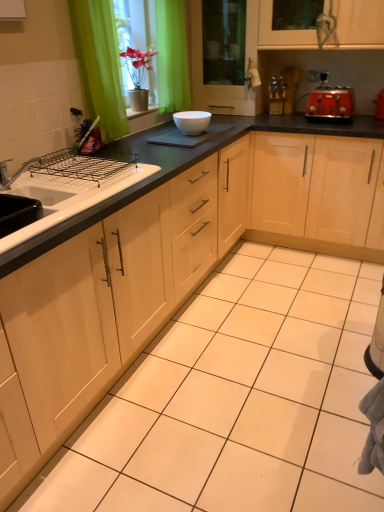
Describe the element at coordinates (315, 193) in the screenshot. I see `light wood cabinet at center, which ranks as the 1th cabinetry in right-to-left order` at that location.

Describe the element at coordinates (68, 187) in the screenshot. I see `white glossy sink at left` at that location.

The height and width of the screenshot is (512, 384). What are the coordinates of `red matte toaster at upper right` in the screenshot? It's located at (330, 102).

This screenshot has width=384, height=512. Describe the element at coordinates (100, 64) in the screenshot. I see `green fabric curtain at upper left` at that location.

From the picture: Measure the distance between point (114, 83) and camera.

The distance of point (114, 83) from camera is 2.24 meters.

This screenshot has width=384, height=512. What do you see at coordinates (192, 121) in the screenshot?
I see `white glossy bowl at center` at bounding box center [192, 121].

Locate an element on the screen. Image resolution: width=384 pixels, height=512 pixels. transparent glass screen door at upper center is located at coordinates (223, 55).

This screenshot has height=512, width=384. In order to click on light wood cabinet at center, which ranks as the 1th cabinetry in right-to-left order in this screenshot , I will do `click(315, 193)`.

Which object is thinner, red matte toaster at upper right or green fabric curtain at upper left?

green fabric curtain at upper left is thinner.

From a real-world perspective, which is physically below, red matte toaster at upper right or green fabric curtain at upper left?

red matte toaster at upper right is physically lower.

In the scene shown: Considering the relative sizes of red matte toaster at upper right and green fabric curtain at upper left in the image provided, is red matte toaster at upper right bigger than green fabric curtain at upper left?

Actually, red matte toaster at upper right might be smaller than green fabric curtain at upper left.

Considering the relative sizes of red matte toaster at upper right and green fabric curtain at upper left in the image provided, is red matte toaster at upper right shorter than green fabric curtain at upper left?

Yes.

In the image, is light wood cabinet at center, which appears as the second cabinetry when viewed from the left, positioned in front of or behind red matte toaster at upper right?

In the image, light wood cabinet at center, which appears as the second cabinetry when viewed from the left, appears in front of red matte toaster at upper right.

From a real-world perspective, does light wood cabinet at center, which ranks as the 1th cabinetry in right-to-left order, sit lower than red matte toaster at upper right?

Yes, from a real-world perspective, light wood cabinet at center, which ranks as the 1th cabinetry in right-to-left order, is below red matte toaster at upper right.

Where is `appliance above the light wood cabinet at center, which ranks as the 1th cabinetry in right-to-left order (from a real-world perspective)`? This screenshot has width=384, height=512. appliance above the light wood cabinet at center, which ranks as the 1th cabinetry in right-to-left order (from a real-world perspective) is located at coordinates (330, 102).

Is transparent glass screen door at upper center surrounded by matte wood cabinet at center, which appears as the 2th cabinetry when viewed from the right?

Actually, transparent glass screen door at upper center is outside matte wood cabinet at center, which appears as the 2th cabinetry when viewed from the right.

In the image, is matte wood cabinet at center, the 1th cabinetry viewed from the left, positioned in front of or behind transparent glass screen door at upper center?

matte wood cabinet at center, the 1th cabinetry viewed from the left, is in front of transparent glass screen door at upper center.

Is matte wood cabinet at center, which appears as the 2th cabinetry when viewed from the right, to the left of transparent glass screen door at upper center from the viewer's perspective?

Correct, you'll find matte wood cabinet at center, which appears as the 2th cabinetry when viewed from the right, to the left of transparent glass screen door at upper center.

Is matte wood cabinet at center, which appears as the 2th cabinetry when viewed from the right, wider than transparent glass screen door at upper center?

Indeed, matte wood cabinet at center, which appears as the 2th cabinetry when viewed from the right, has a greater width compared to transparent glass screen door at upper center.

You are a GUI agent. You are given a task and a screenshot of the screen. Output one action in this format:
    pyautogui.click(x=<x>, y=<y>)
    Task: Click on the bowl below the transparent glass screen door at upper center (from the image's perspective)
    The height and width of the screenshot is (512, 384).
    Given the screenshot: What is the action you would take?
    pyautogui.click(x=192, y=121)

In terms of size, does transparent glass screen door at upper center appear bigger or smaller than white glossy bowl at center?

transparent glass screen door at upper center is bigger than white glossy bowl at center.

Are transparent glass screen door at upper center and white glossy bowl at center making contact?

No, transparent glass screen door at upper center is not beside white glossy bowl at center.

Is red matte toaster at upper right oriented towards matte wood cabinet at center, which appears as the 2th cabinetry when viewed from the right?

Yes, red matte toaster at upper right is turned towards matte wood cabinet at center, which appears as the 2th cabinetry when viewed from the right.

Is red matte toaster at upper right completely or partially outside of matte wood cabinet at center, the 1th cabinetry viewed from the left?

Indeed, red matte toaster at upper right is completely outside matte wood cabinet at center, the 1th cabinetry viewed from the left.

In the image, is red matte toaster at upper right positioned in front of or behind matte wood cabinet at center, which appears as the 2th cabinetry when viewed from the right?

Visually, red matte toaster at upper right is located behind matte wood cabinet at center, which appears as the 2th cabinetry when viewed from the right.

Visually, is red matte toaster at upper right positioned to the left or to the right of matte wood cabinet at center, which appears as the 2th cabinetry when viewed from the right?

red matte toaster at upper right is positioned on matte wood cabinet at center, which appears as the 2th cabinetry when viewed from the right,'s right side.

Is white glossy sink at left shorter than red matte toaster at upper right?

Yes, white glossy sink at left is shorter than red matte toaster at upper right.

How distant is white glossy sink at left from red matte toaster at upper right?

The distance of white glossy sink at left from red matte toaster at upper right is 1.63 meters.

Looking at this image, from the image's perspective, who appears lower, white glossy sink at left or red matte toaster at upper right?

white glossy sink at left is shown below in the image.

Identify the location of sink that is on the left side of red matte toaster at upper right. Image resolution: width=384 pixels, height=512 pixels. (68, 187).

Are matte wood cabinet at center, the 1th cabinetry viewed from the left, and red matte toaster at upper right making contact?

No, matte wood cabinet at center, the 1th cabinetry viewed from the left, is not next to red matte toaster at upper right.

Would you say red matte toaster at upper right is part of matte wood cabinet at center, which appears as the 2th cabinetry when viewed from the right,'s contents?

Actually, red matte toaster at upper right is outside matte wood cabinet at center, which appears as the 2th cabinetry when viewed from the right.

Considering the relative sizes of matte wood cabinet at center, which appears as the 2th cabinetry when viewed from the right, and red matte toaster at upper right in the image provided, is matte wood cabinet at center, which appears as the 2th cabinetry when viewed from the right, smaller than red matte toaster at upper right?

Incorrect, matte wood cabinet at center, which appears as the 2th cabinetry when viewed from the right, is not smaller in size than red matte toaster at upper right.

Is matte wood cabinet at center, the 1th cabinetry viewed from the left, in front of or behind red matte toaster at upper right in the image?

Visually, matte wood cabinet at center, the 1th cabinetry viewed from the left, is located in front of red matte toaster at upper right.

Locate an element on the screen. appliance lying on the right of green fabric curtain at upper left is located at coordinates (330, 102).

In the image, there is a light wood cabinet at center, which ranks as the 1th cabinetry in right-to-left order. Where is `appliance above it (from the image's perspective)`? The height and width of the screenshot is (512, 384). appliance above it (from the image's perspective) is located at coordinates (330, 102).

Which object lies nearer to the anchor point white glossy bowl at center, red matte toaster at upper right or transparent glass screen door at upper center?

transparent glass screen door at upper center lies closer to white glossy bowl at center than the other object.

From the image, which object appears to be farther from white glossy sink at left, transparent glass screen door at upper center or white glossy bowl at center?

transparent glass screen door at upper center is positioned further to the anchor white glossy sink at left.

Estimate the real-world distances between objects in this image. Which object is closer to white glossy bowl at center, red matte toaster at upper right or green fabric curtain at upper left?

green fabric curtain at upper left is closer to white glossy bowl at center.

Estimate the real-world distances between objects in this image. Which object is further from light wood cabinet at center, which appears as the second cabinetry when viewed from the left, white glossy sink at left or matte wood cabinet at center, which appears as the 2th cabinetry when viewed from the right?

white glossy sink at left lies further to light wood cabinet at center, which appears as the second cabinetry when viewed from the left, than the other object.

Looking at the image, which one is located further to light wood cabinet at center, which ranks as the 1th cabinetry in right-to-left order, matte wood cabinet at center, which appears as the 2th cabinetry when viewed from the right, or white glossy sink at left?

white glossy sink at left lies further to light wood cabinet at center, which ranks as the 1th cabinetry in right-to-left order, than the other object.

Which object lies nearer to the anchor point green fabric curtain at upper left, matte wood cabinet at center, the 1th cabinetry viewed from the left, or white glossy sink at left?

Among the two, white glossy sink at left is located nearer to green fabric curtain at upper left.

When comparing their distances from transparent glass screen door at upper center, does white glossy bowl at center or red matte toaster at upper right seem further?

Based on the image, white glossy bowl at center appears to be further to transparent glass screen door at upper center.

When comparing their distances from green fabric curtain at upper left, does white glossy sink at left or light wood cabinet at center, which appears as the second cabinetry when viewed from the left, seem further?

Among the two, light wood cabinet at center, which appears as the second cabinetry when viewed from the left, is located further to green fabric curtain at upper left.

The width and height of the screenshot is (384, 512). Find the location of `sink between matte wood cabinet at center, the 1th cabinetry viewed from the left, and light wood cabinet at center, which ranks as the 1th cabinetry in right-to-left order, along the z-axis`. sink between matte wood cabinet at center, the 1th cabinetry viewed from the left, and light wood cabinet at center, which ranks as the 1th cabinetry in right-to-left order, along the z-axis is located at coordinates (68, 187).

What are the coordinates of `bowl between green fabric curtain at upper left and light wood cabinet at center, which ranks as the 1th cabinetry in right-to-left order, in the horizontal direction` in the screenshot? It's located at (192, 121).

The image size is (384, 512). In order to click on bowl between white glossy sink at left and transparent glass screen door at upper center in the front-back direction in this screenshot , I will do `click(192, 121)`.

You are a GUI agent. You are given a task and a screenshot of the screen. Output one action in this format:
    pyautogui.click(x=<x>, y=<y>)
    Task: Click on the curtain located between matte wood cabinet at center, which appears as the 2th cabinetry when viewed from the right, and red matte toaster at upper right in the depth direction
    
    Given the screenshot: What is the action you would take?
    pyautogui.click(x=100, y=64)